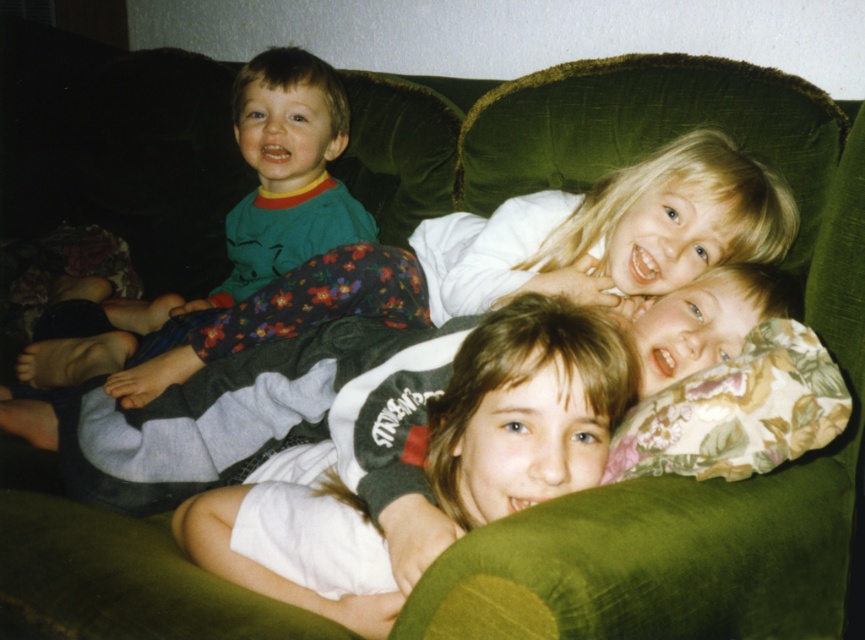
Who is lower down, floral pajama pants at upper center or floral fabric pillow at lower right?

floral fabric pillow at lower right

Is floral pajama pants at upper center bigger than floral fabric pillow at lower right?

Indeed, floral pajama pants at upper center has a larger size compared to floral fabric pillow at lower right.

In the scene shown: Measure the distance between floral pajama pants at upper center and camera.

1.17 meters

You are a GUI agent. You are given a task and a screenshot of the screen. Output one action in this format:
    pyautogui.click(x=<x>, y=<y>)
    Task: Click on the floral pajama pants at upper center
    This screenshot has width=865, height=640.
    Given the screenshot: What is the action you would take?
    pyautogui.click(x=476, y=266)

Does floral fabric pillow at lower right have a larger size compared to matte green pajamas at left?

No, floral fabric pillow at lower right is not bigger than matte green pajamas at left.

Who is more distant from viewer, (650, 458) or (317, 76)?

The point (317, 76) is behind.

Find the location of a particular element. The width and height of the screenshot is (865, 640). floral fabric pillow at lower right is located at coordinates (737, 412).

Who is more distant from viewer, (312, 248) or (324, 244)?

The point (312, 248) is behind.

Does green soft pajamas at left have a greater height compared to matte green pajamas at left?

Correct, green soft pajamas at left is much taller as matte green pajamas at left.

Identify the location of green soft pajamas at left. The width and height of the screenshot is (865, 640). (274, 184).